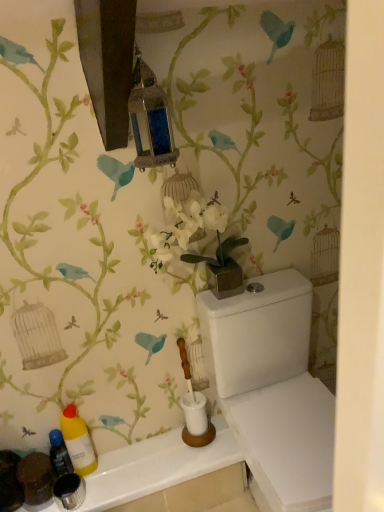
Find the location of a particular element. free space above white glossy counter top at lower left (from a real-world perspective) is located at coordinates (131, 468).